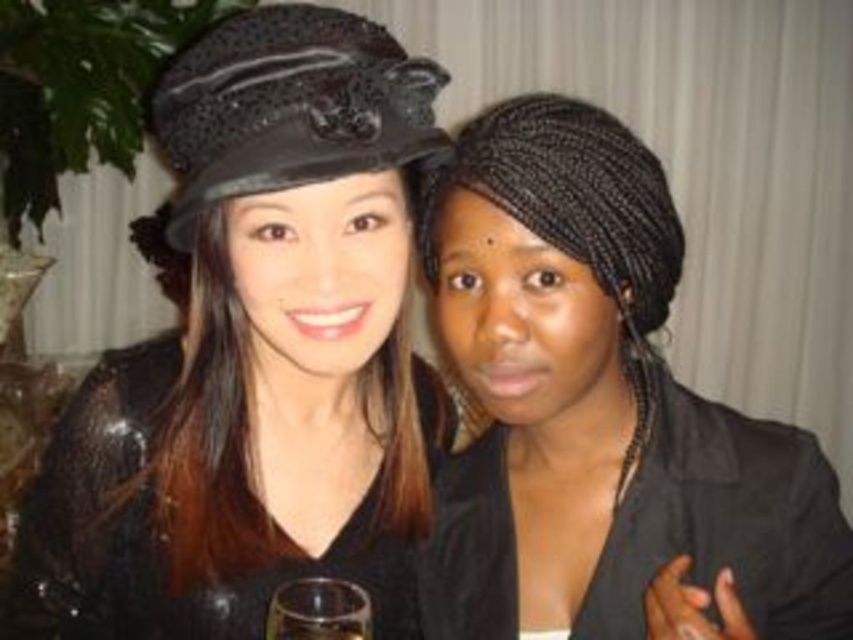
You are a photographer trying to capture a clear shot of the transparent glass at center. However, the matte black hat at upper left is blocking your view. Can you determine if the hat is in front of or behind the glass?

The matte black hat at upper left is positioned over the transparent glass at center, so it is in front of the glass.

You are a photographer setting up a shot. You notice the black braided hair at center and the black textured hat at upper left. Which object is positioned lower in the frame?

The black braided hair at center is below black textured hat at upper left, so the black braided hair at center is positioned lower in the frame.